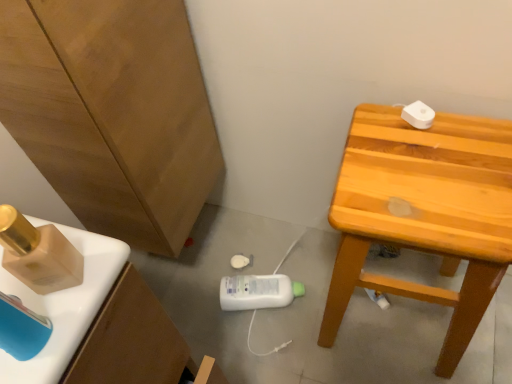
Question: From a real-world perspective, is light brown wooden stool at upper right located beneath matte wood cabinet at left?

Choices:
 (A) no
 (B) yes

Answer: (B)

Question: Can you confirm if light brown wooden stool at upper right is positioned to the right of matte wood cabinet at left?

Choices:
 (A) yes
 (B) no

Answer: (A)

Question: Considering the relative sizes of light brown wooden stool at upper right and matte wood cabinet at left in the image provided, is light brown wooden stool at upper right thinner than matte wood cabinet at left?

Choices:
 (A) no
 (B) yes

Answer: (A)

Question: From the image's perspective, is light brown wooden stool at upper right above matte wood cabinet at left?

Choices:
 (A) no
 (B) yes

Answer: (A)

Question: Does light brown wooden stool at upper right have a greater height compared to matte wood cabinet at left?

Choices:
 (A) no
 (B) yes

Answer: (B)

Question: Is light brown wooden stool at upper right further to the viewer compared to matte wood cabinet at left?

Choices:
 (A) no
 (B) yes

Answer: (B)

Question: Is light brown wooden stool at upper right completely or partially inside matte wood cabinet at left?

Choices:
 (A) no
 (B) yes

Answer: (A)

Question: From a real-world perspective, is matte wood cabinet at left positioned over light brown wooden stool at upper right based on gravity?

Choices:
 (A) no
 (B) yes

Answer: (B)

Question: From the image's perspective, is matte wood cabinet at left below light brown wooden stool at upper right?

Choices:
 (A) no
 (B) yes

Answer: (A)

Question: Does matte wood cabinet at left have a lesser width compared to light brown wooden stool at upper right?

Choices:
 (A) yes
 (B) no

Answer: (A)

Question: Considering the relative sizes of matte wood cabinet at left and light brown wooden stool at upper right in the image provided, is matte wood cabinet at left wider than light brown wooden stool at upper right?

Choices:
 (A) yes
 (B) no

Answer: (B)

Question: Is matte wood cabinet at left aimed at light brown wooden stool at upper right?

Choices:
 (A) yes
 (B) no

Answer: (A)

Question: Considering the positions of light brown wooden stool at upper right and matte wood cabinet at left in the image, is light brown wooden stool at upper right wider or thinner than matte wood cabinet at left?

Choices:
 (A) thin
 (B) wide

Answer: (B)